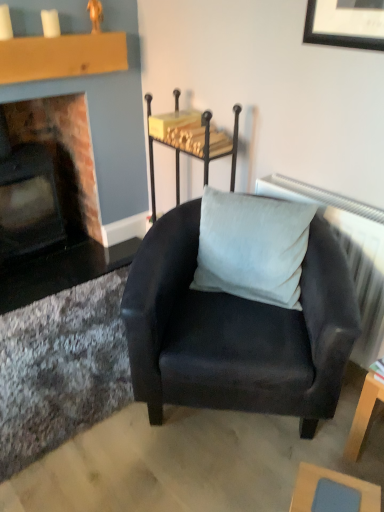
Find the location of a particular element. vacant point above light blue fabric table at lower right, the second table viewed from the right (from a real-world perspective) is located at coordinates (340, 492).